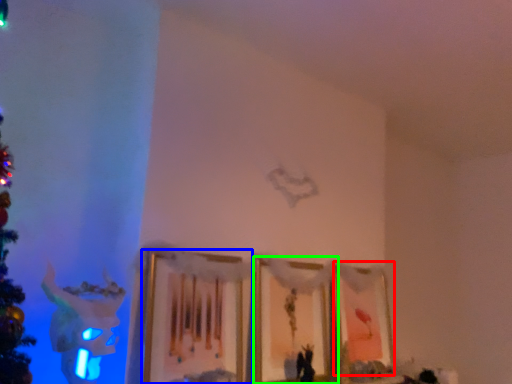
Question: Considering the real-world distances, which object is farthest from picture frame (highlighted by a red box)? picture frame (highlighted by a blue box) or picture frame (highlighted by a green box)?

Choices:
 (A) picture frame
 (B) picture frame

Answer: (A)